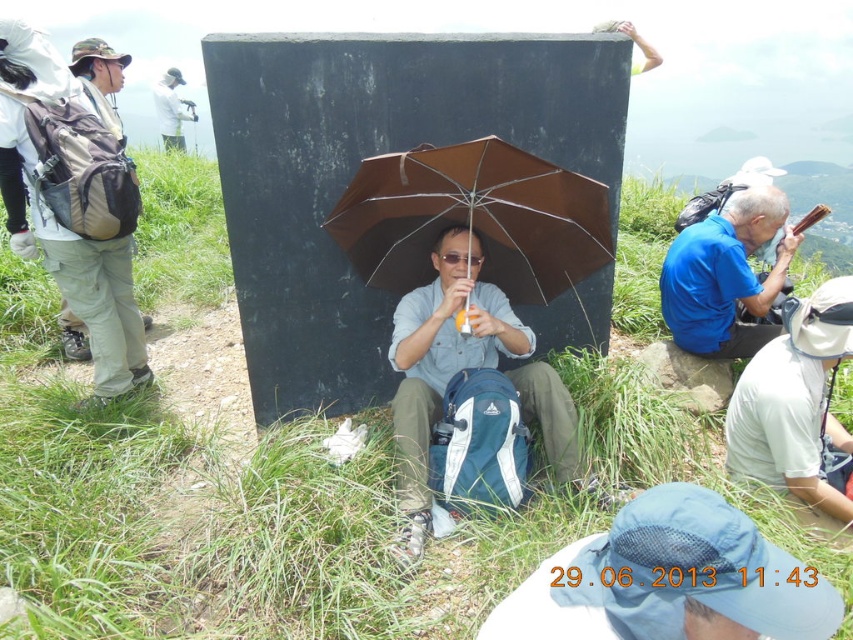
Is blue fabric shirt at center above white fabric camera at upper left?

No.

At what (x,y) coordinates should I click in order to perform the action: click on blue fabric shirt at center. Please return your answer as a coordinate pair (x, y). Looking at the image, I should click on (724, 275).

Can you confirm if matte blue backpack at center is positioned to the right of white fabric camera at upper left?

Yes, matte blue backpack at center is to the right of white fabric camera at upper left.

Who is taller, matte blue backpack at center or white fabric camera at upper left?

Standing taller between the two is white fabric camera at upper left.

You are a GUI agent. You are given a task and a screenshot of the screen. Output one action in this format:
    pyautogui.click(x=<x>, y=<y>)
    Task: Click on the matte blue backpack at center
    The width and height of the screenshot is (853, 640).
    Given the screenshot: What is the action you would take?
    pyautogui.click(x=440, y=364)

Between brown matte umbrella at center and white fabric camera at upper left, which one is positioned higher?

Positioned higher is white fabric camera at upper left.

Between point (415, 205) and point (184, 102), which one is positioned in front?

Point (415, 205) is more forward.

You are a GUI agent. You are given a task and a screenshot of the screen. Output one action in this format:
    pyautogui.click(x=<x>, y=<y>)
    Task: Click on the brown matte umbrella at center
    
    Given the screenshot: What is the action you would take?
    pyautogui.click(x=473, y=218)